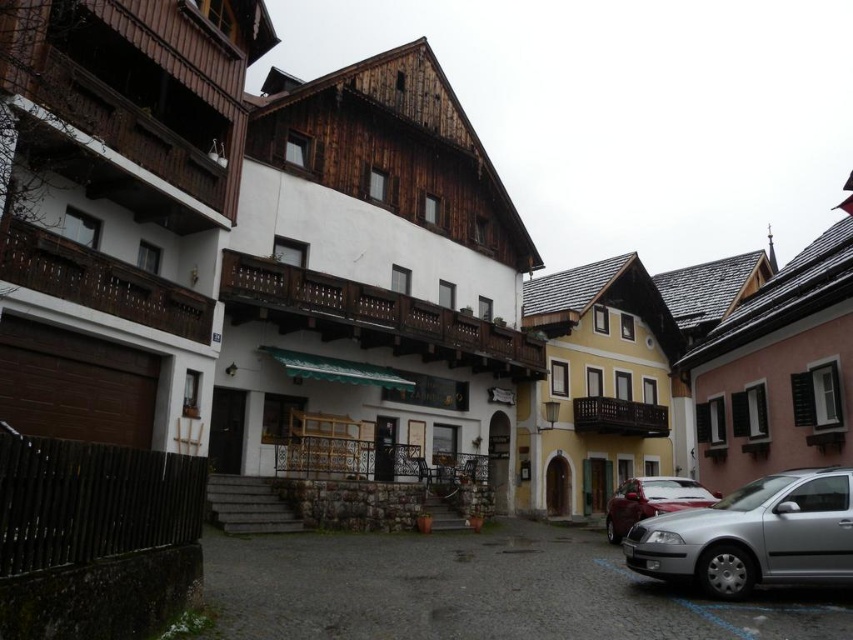
You are a delivery driver trying to park your car in this village. The parking spot is at coordinate point 0.838, 0.884. Is the silver metallic car at lower right currently occupying that spot?

The silver metallic car at lower right is positioned at point (x=753, y=536), so yes, it is occupying the parking spot at that coordinate.

Looking at this image, you are a pedestrian standing at the edge of the street. You see the silver metallic car at lower right and the shiny red car at lower right parked behind it. Can you walk between them?

The silver metallic car at lower right is in front of the shiny red car at lower right, so there is no space between them for walking.